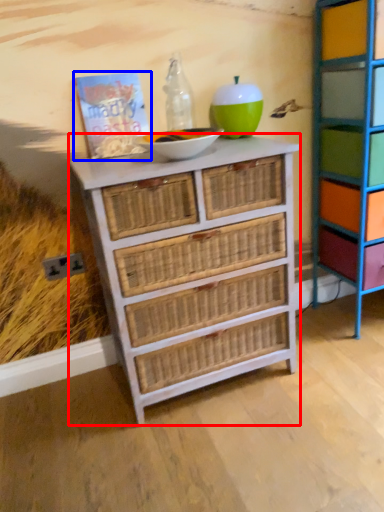
Question: Which of the following is the farthest to the observer, chest of drawers (highlighted by a red box) or book (highlighted by a blue box)?

Choices:
 (A) chest of drawers
 (B) book

Answer: (B)